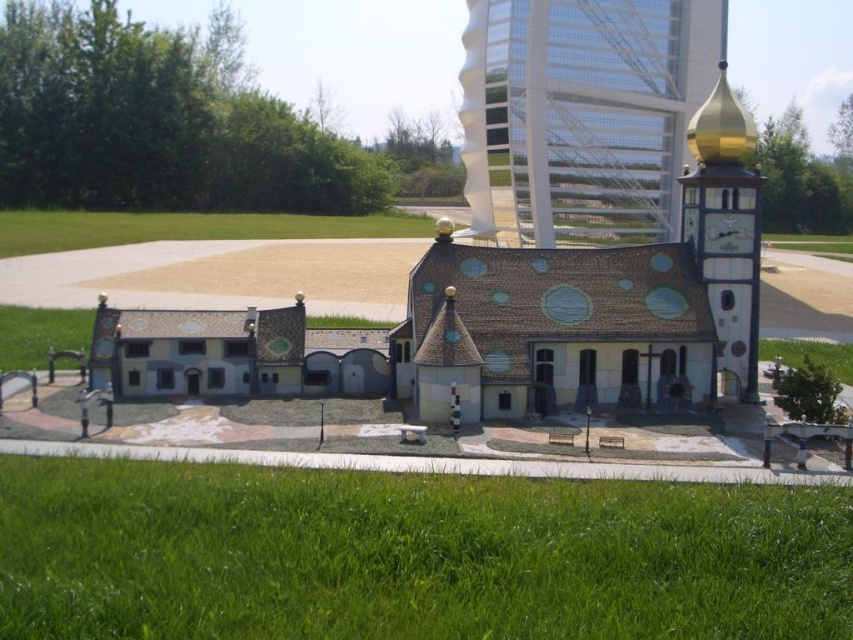
You are an architect reviewing the miniature model of the building. You need to determine which object has a greater height between the matte gold dome at upper center and the gold metallic clock tower at upper right. Based on the model, which one is taller?

The gold metallic clock tower at upper right is taller than the matte gold dome at upper center.

You are a visitor standing in front of the miniature model of the building. You want to take a photo of the gold metallic clock tower at upper right without the matte gold dome at upper center blocking the view. Is this possible from your current position?

The gold metallic clock tower at upper right is behind the matte gold dome at upper center, so taking a photo of the gold metallic clock tower at upper right without the matte gold dome at upper center blocking the view from your current position is not possible.

From the picture: You are standing in front of the miniature model of the building. You want to know if you can touch the matte gold dome at upper center without moving closer than your current position. Your outstretched hand can reach up to 2.5 feet in front of you. Is it possible?

The matte gold dome at upper center is 191.20 feet away from the viewer. Since your hand can only reach 2.5 feet, you cannot touch it without moving closer.